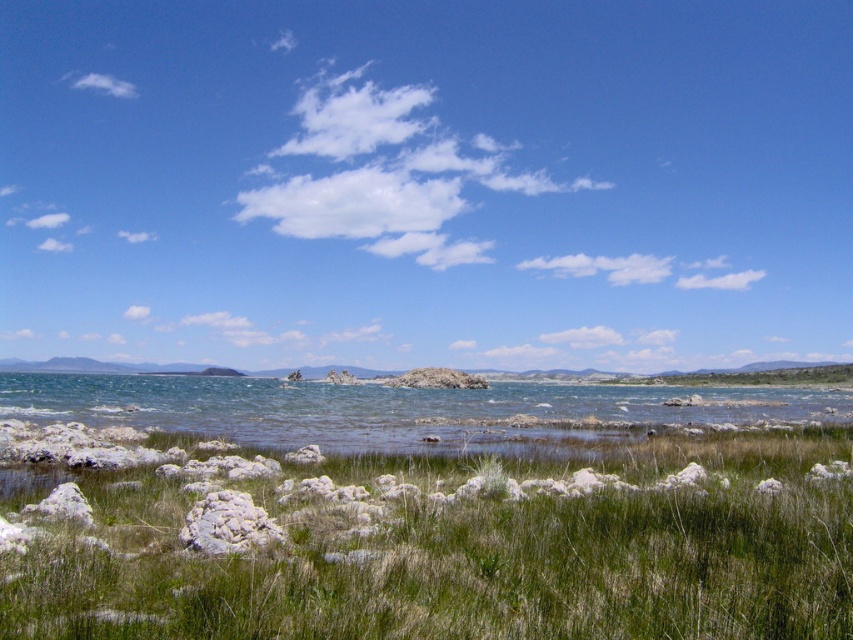
You are standing in the middle of the green grassy at lower center and want to walk to the white fluffy cloud at upper left. Can you reach the cloud without leaving the grassy area?

The green grassy at lower center has a lesser width compared to the white fluffy cloud at upper left. Since the cloud is in the sky and the grassy area is on the ground, you cannot reach the cloud while staying on the grassy area.